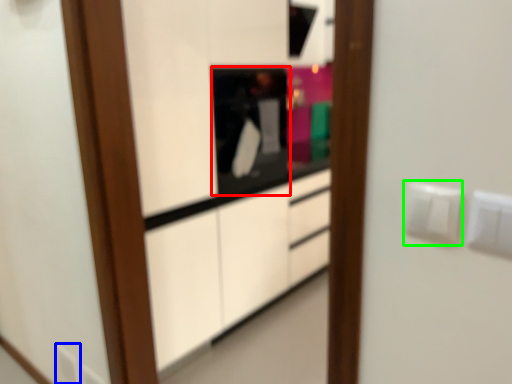
Question: Based on their relative distances, which object is farther from appliance (highlighted by a red box)? Choose from electric outlet (highlighted by a blue box) and electric outlet (highlighted by a green box).

Choices:
 (A) electric outlet
 (B) electric outlet

Answer: (B)